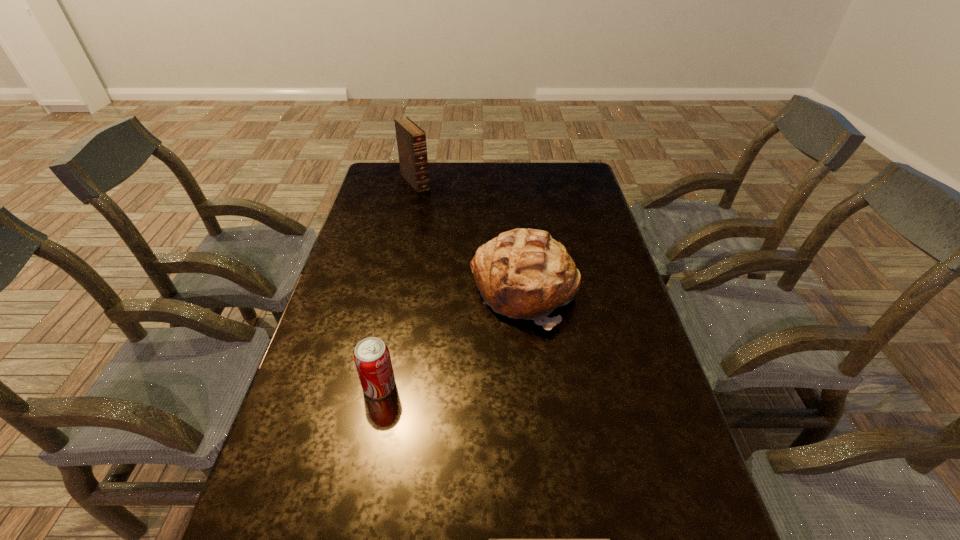
Identify the location of Bible at the left edge. click(x=411, y=140).

Locate an element on the screen. This screenshot has width=960, height=540. soda can that is at the left edge is located at coordinates point(372,359).

This screenshot has height=540, width=960. What are the coordinates of `object that is at the right edge` in the screenshot? It's located at (523, 273).

This screenshot has height=540, width=960. I want to click on object positioned at the far left corner, so click(411, 140).

In the image, there is a desktop. Identify the location of vacant space at the far edge. The width and height of the screenshot is (960, 540). (538, 171).

This screenshot has height=540, width=960. In the image, there is a desktop. In order to click on vacant space at the left edge in this screenshot , I will do `click(400, 206)`.

What are the coordinates of `free region at the right edge` in the screenshot? It's located at (614, 468).

The image size is (960, 540). I want to click on free space at the far right corner, so click(x=582, y=186).

Identify the location of free space between the third nearest object and the third tallest object. The image size is (960, 540). (452, 339).

Identify the location of empty location between the farther Bible and the third farthest object. The image size is (960, 540). (397, 284).